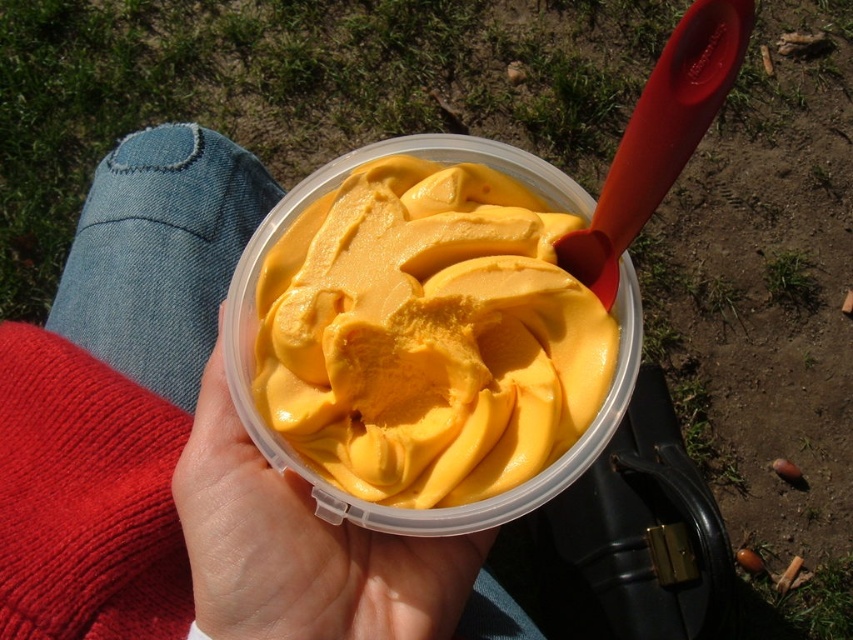
You are at a park and want to choose the larger portion of ice cream between the yellow creamy ice cream at center and the yellow matte ice cream at center. Which one should you pick?

The yellow creamy ice cream at center is bigger than the yellow matte ice cream at center, so you should pick the yellow creamy ice cream at center.